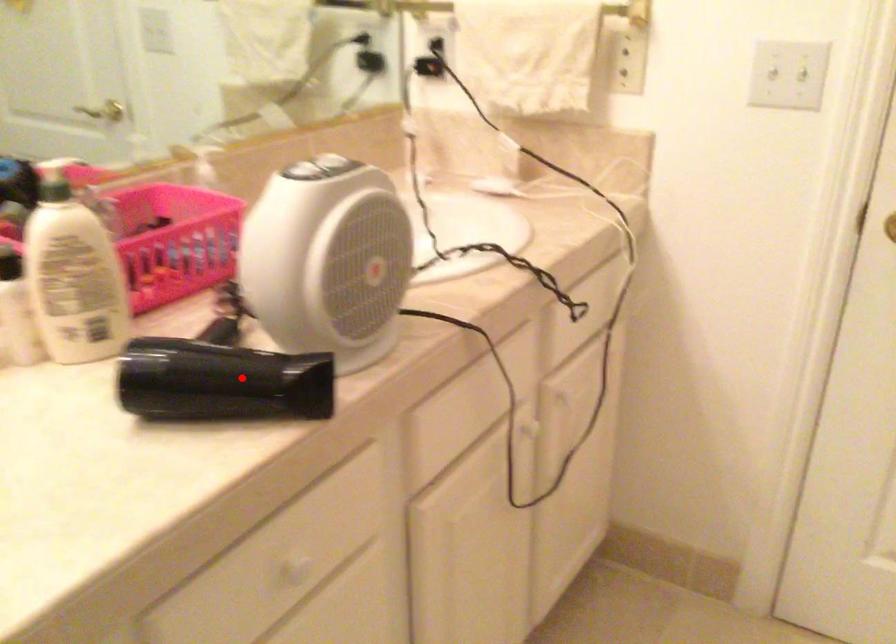
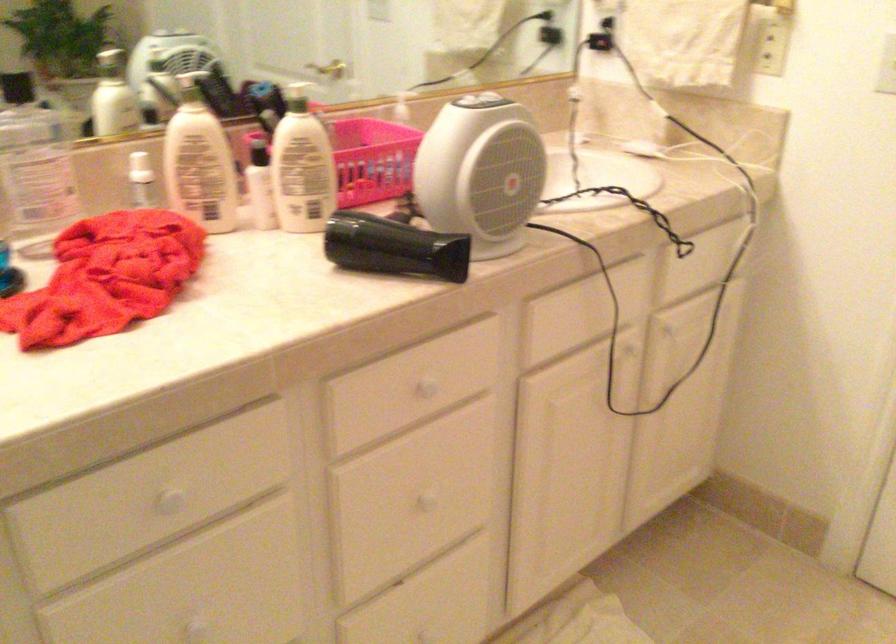
In the second image, find the point that corresponds to the highlighted location in the first image.

(393, 247)